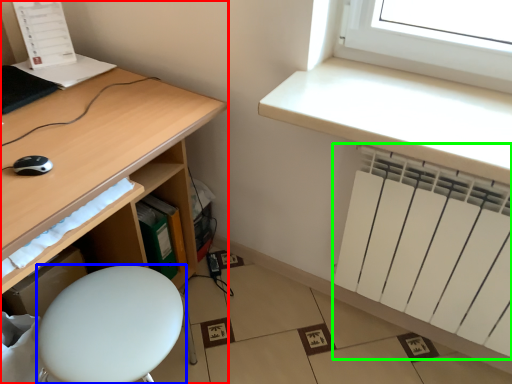
Question: Which object is the closest to the desk (highlighted by a red box)? Choose among these: furniture (highlighted by a blue box) or radiator (highlighted by a green box).

Choices:
 (A) furniture
 (B) radiator

Answer: (A)